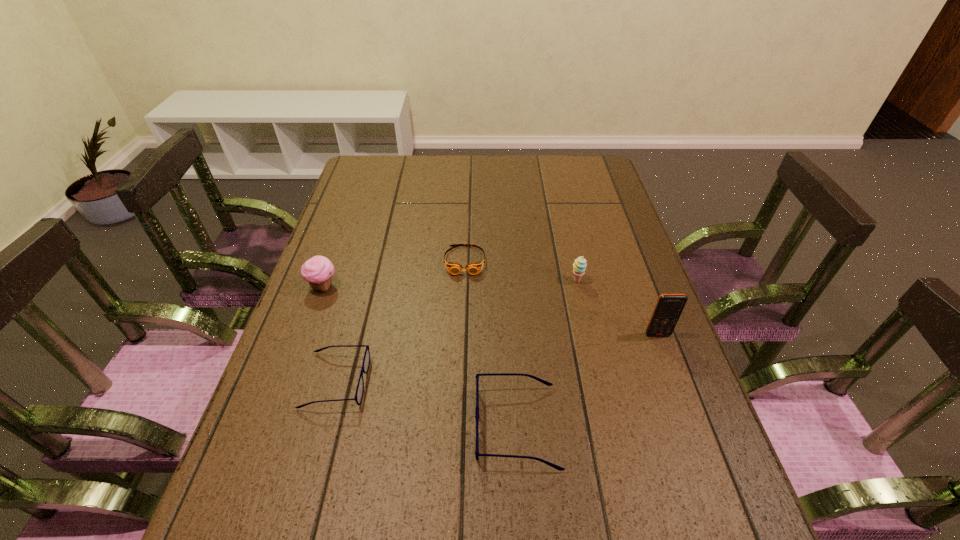
Where is `free spot between the sherbert and the left spectacles`? free spot between the sherbert and the left spectacles is located at coordinates (457, 330).

Find the location of a particular element. This screenshot has height=540, width=960. vacant space that's between the cupcake and the rightmost object is located at coordinates (491, 310).

You are a GUI agent. You are given a task and a screenshot of the screen. Output one action in this format:
    pyautogui.click(x=<x>, y=<y>)
    Task: Click on the free spot between the cupcake and the shorter spectacles
    
    Given the screenshot: What is the action you would take?
    pyautogui.click(x=330, y=334)

Locate an element on the screen. This screenshot has height=540, width=960. vacant space that's between the goggles and the shorter spectacles is located at coordinates (400, 321).

You are a GUI agent. You are given a task and a screenshot of the screen. Output one action in this format:
    pyautogui.click(x=<x>, y=<y>)
    Task: Click on the free space between the cellular telephone and the cupcake
    
    Given the screenshot: What is the action you would take?
    pyautogui.click(x=491, y=310)

Find the location of a particular element. the closest object to the shorter spectacles is located at coordinates click(x=318, y=271).

Identify which object is the fourth nearest to the goggles. Please provide its 2D coordinates. Your answer should be formatted as a tuple, i.e. [(x, y)], where the tuple contains the x and y coordinates of a point satisfying the conditions above.

[(477, 454)]

At what (x,y) coordinates should I click in order to perform the action: click on vacant space that satisfies the following two spatial constraints: 1. on the screen of the tallest object; 2. on the front-facing side of the left spectacles. Please return your answer as a coordinate pair (x, y). Looking at the image, I should click on (675, 381).

Where is `vacant area in the image that satisfies the following two spatial constraints: 1. on the screen of the third nearest object; 2. on the front-facing side of the shorter spectacles`? vacant area in the image that satisfies the following two spatial constraints: 1. on the screen of the third nearest object; 2. on the front-facing side of the shorter spectacles is located at coordinates (675, 381).

Identify the location of vacant area that satisfies the following two spatial constraints: 1. on the screen of the rightmost object; 2. on the front-facing side of the third shortest object. (691, 426).